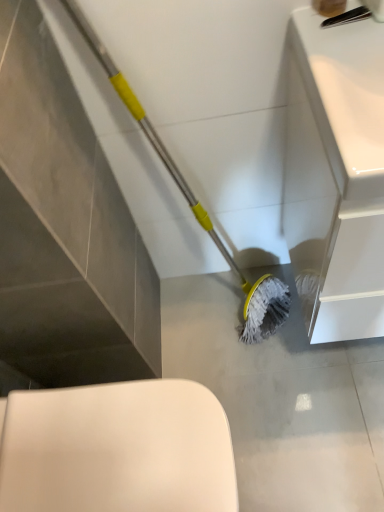
Identify the location of white glossy toilet at lower left. (117, 449).

Does gray matte mop head at lower center have a larger size compared to white glossy toilet at lower left?

Incorrect, gray matte mop head at lower center is not larger than white glossy toilet at lower left.

How distant is gray matte mop head at lower center from white glossy toilet at lower left?

The distance of gray matte mop head at lower center from white glossy toilet at lower left is 19.03 inches.

Can you confirm if gray matte mop head at lower center is shorter than white glossy toilet at lower left?

Yes, gray matte mop head at lower center is shorter than white glossy toilet at lower left.

Which is correct: white glossy toilet at lower left is inside gray matte mop head at lower center, or outside of it?

white glossy toilet at lower left is spatially situated outside gray matte mop head at lower center.

Consider the image. Is white glossy toilet at lower left shorter than gray matte mop head at lower center?

No.

Between white glossy toilet at lower left and gray matte mop head at lower center, which one appears on the left side from the viewer's perspective?

From the viewer's perspective, white glossy toilet at lower left appears more on the left side.

Looking at their sizes, would you say white glossy sink at upper right is wider or thinner than gray matte mop head at lower center?

Clearly, white glossy sink at upper right has less width compared to gray matte mop head at lower center.

Find the location of a particular element. This screenshot has height=512, width=384. concrete located underneath the white glossy sink at upper right (from a real-world perspective) is located at coordinates (282, 398).

From the image's perspective, is white glossy sink at upper right positioned above or below gray matte mop head at lower center?

From the image's perspective, white glossy sink at upper right appears above gray matte mop head at lower center.

From the picture: From the image's perspective, does white glossy sink at upper right appear lower than white glossy toilet at lower left?

No, from the image's perspective, white glossy sink at upper right is not beneath white glossy toilet at lower left.

Which of these two, white glossy sink at upper right or white glossy toilet at lower left, is thinner?

white glossy sink at upper right is thinner.

Considering the relative sizes of white glossy sink at upper right and white glossy toilet at lower left in the image provided, is white glossy sink at upper right smaller than white glossy toilet at lower left?

Actually, white glossy sink at upper right might be larger than white glossy toilet at lower left.

The height and width of the screenshot is (512, 384). In order to click on counter top in front of the white glossy toilet at lower left in this screenshot , I will do `click(336, 173)`.

Is gray matte mop head at lower center directly adjacent to white glossy sink at upper right?

No, gray matte mop head at lower center is not beside white glossy sink at upper right.

From the image's perspective, which is above, gray matte mop head at lower center or white glossy sink at upper right?

white glossy sink at upper right appears higher in the image.

Measure the distance between gray matte mop head at lower center and white glossy sink at upper right.

The distance of gray matte mop head at lower center from white glossy sink at upper right is 17.80 inches.

Considering the points (232, 379) and (344, 144), which point is behind, point (232, 379) or point (344, 144)?

Point (232, 379)

Who is smaller, white glossy toilet at lower left or white glossy sink at upper right?

white glossy toilet at lower left is smaller.

Looking at this image, from the image's perspective, is white glossy toilet at lower left located above white glossy sink at upper right?

No, from the image's perspective, white glossy toilet at lower left is not over white glossy sink at upper right.

Is white glossy toilet at lower left positioned far away from white glossy sink at upper right?

No.

In the image, there is a white glossy toilet at lower left. Identify the location of concrete below it (from a real-world perspective). This screenshot has height=512, width=384. (282, 398).

Locate an element on the screen. Image resolution: width=384 pixels, height=512 pixels. toilet on the left of gray matte mop head at lower center is located at coordinates pos(117,449).

From the picture: Considering their positions, is gray matte mop head at lower center positioned further to white glossy sink at upper right than white glossy toilet at lower left?

white glossy toilet at lower left lies further to white glossy sink at upper right than the other object.

From the image, which object appears to be nearer to white glossy toilet at lower left, white glossy sink at upper right or gray matte mop head at lower center?

gray matte mop head at lower center is positioned closer to the anchor white glossy toilet at lower left.

When comparing their distances from gray matte mop head at lower center, does white glossy toilet at lower left or white glossy sink at upper right seem closer?

white glossy sink at upper right is closer to gray matte mop head at lower center.

From the image, which object appears to be nearer to white glossy toilet at lower left, gray matte mop head at lower center or white glossy sink at upper right?

Based on the image, gray matte mop head at lower center appears to be nearer to white glossy toilet at lower left.

From the image, which object appears to be farther from white glossy sink at upper right, white glossy toilet at lower left or gray matte mop head at lower center?

The object further to white glossy sink at upper right is white glossy toilet at lower left.

Considering their positions, is white glossy sink at upper right positioned further to gray matte mop head at lower center than white glossy toilet at lower left?

Among the two, white glossy toilet at lower left is located further to gray matte mop head at lower center.

In order to click on concrete between white glossy sink at upper right and white glossy toilet at lower left in the vertical direction in this screenshot , I will do `click(282, 398)`.